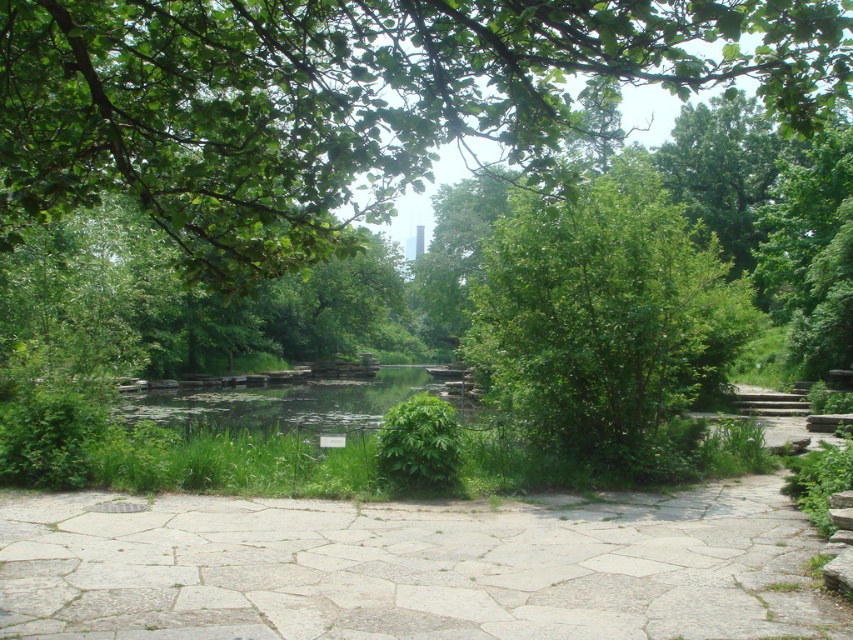
Question: Is green leafy tree at upper center wider than green leafy bush at center?

Choices:
 (A) yes
 (B) no

Answer: (A)

Question: Can you confirm if green leafy tree at upper center is positioned to the left of white stone path at center?

Choices:
 (A) yes
 (B) no

Answer: (B)

Question: Among these points, which one is nearest to the camera?

Choices:
 (A) (653, 401)
 (B) (234, 204)

Answer: (B)

Question: Which object is farther from the camera taking this photo?

Choices:
 (A) green leafy bush at center
 (B) green leafy tree at upper center
 (C) white stone path at center

Answer: (C)

Question: Is white stone path at center to the right of green leafy bush at center from the viewer's perspective?

Choices:
 (A) no
 (B) yes

Answer: (A)

Question: Based on their relative distances, which object is farther from the white stone path at center?

Choices:
 (A) green leafy bush at center
 (B) green leafy tree at upper center

Answer: (B)